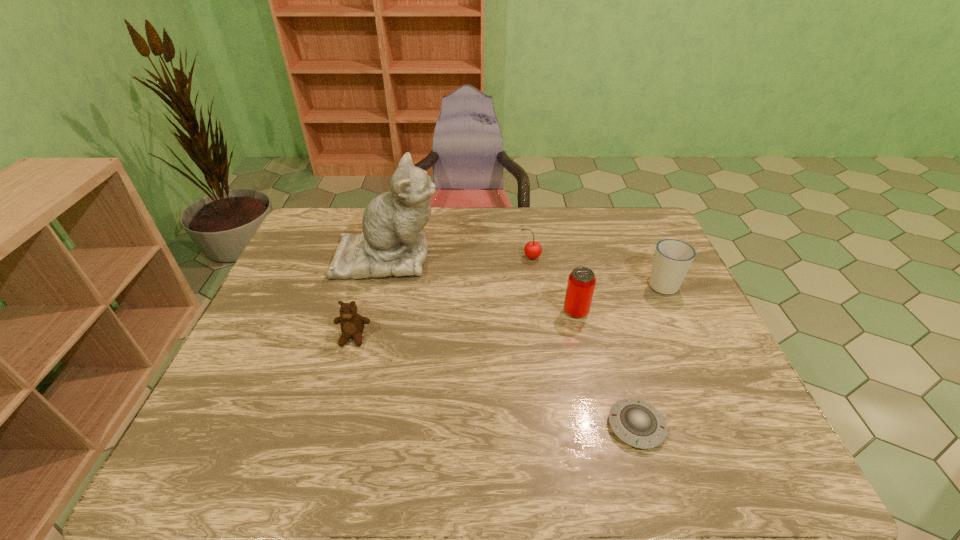
What are the coordinates of `vacant space situated with a handle on the side of the cup` in the screenshot? It's located at (628, 211).

The image size is (960, 540). What are the coordinates of `vacant space located 0.360m with a handle on the side of the cup` in the screenshot? It's located at (627, 207).

This screenshot has height=540, width=960. Identify the location of vacant space located 0.160m on the left of the third object from left to right. (468, 258).

Where is `blank space located 0.180m at the face of the teddy bear`? Image resolution: width=960 pixels, height=540 pixels. blank space located 0.180m at the face of the teddy bear is located at coordinates tap(332, 411).

Identify the location of free spot located 0.220m on the left of the nearest object. (507, 426).

Where is `object that is at the far edge`? The image size is (960, 540). object that is at the far edge is located at coordinates (393, 243).

Identify the location of object present at the near edge. This screenshot has width=960, height=540. (637, 423).

Identify the location of object that is at the left edge. (393, 243).

You are a GUI agent. You are given a task and a screenshot of the screen. Output one action in this format:
    pyautogui.click(x=<x>, y=<y>)
    Task: Click on the object that is at the right edge
    The width and height of the screenshot is (960, 540).
    Given the screenshot: What is the action you would take?
    pyautogui.click(x=672, y=259)

Locate an element on the screen. object that is at the far left corner is located at coordinates (393, 243).